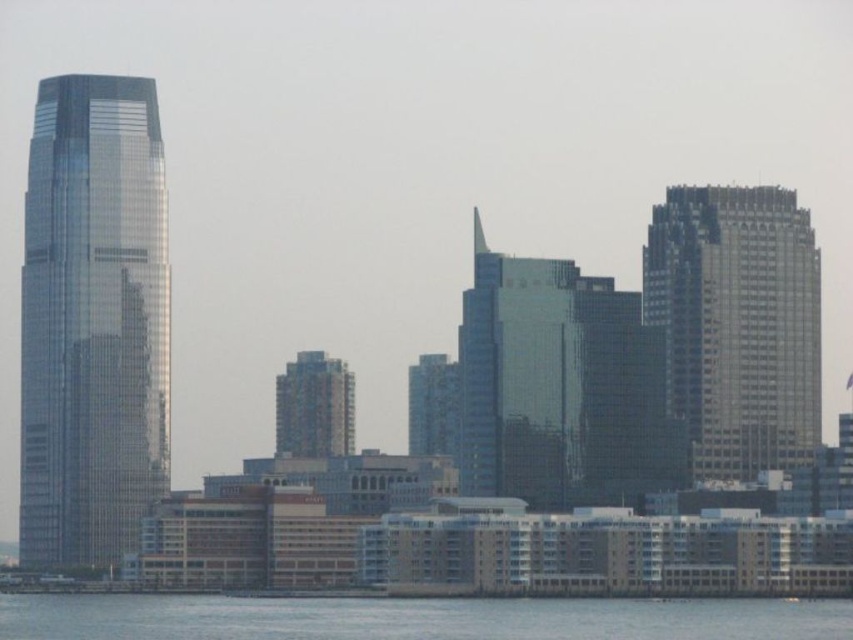
You are a drone operator planning to fly a drone from the shiny glass skyscraper at left to the transparent water at lower center. What is the minimum distance the drone needs to cover to reach the water from the skyscraper?

The minimum distance the drone needs to cover to reach the transparent water at lower center from the shiny glass skyscraper at left is 63.96 meters.

You are an architect evaluating the cityscape. You need to determine which of the two skyscrapers, the shiny glass skyscraper at left or the glassy blue skyscraper at center, has a narrower base. Which one do you conclude?

The shiny glass skyscraper at left has a narrower base than the glassy blue skyscraper at center because its width is less than the latter.

You are standing on the waterfront and want to take a photo of the shiny glass skyscraper at left and the blue glass building at center. Which building should you focus on first to ensure it appears closer in your photo?

You should focus on the shiny glass skyscraper at left first because it is closer to you than the blue glass building at center, so it will naturally appear closer in the photo.